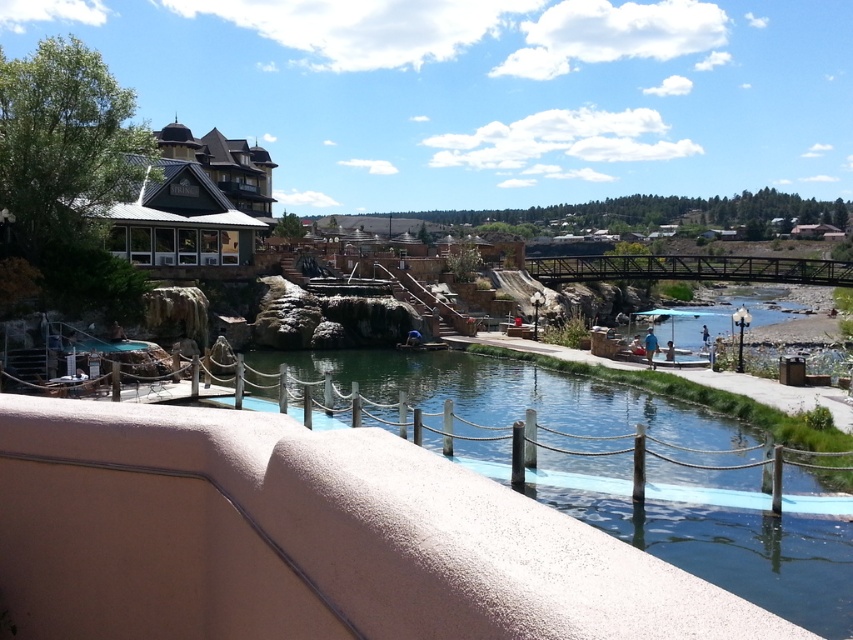
Is point (189, 211) positioned behind point (612, 259)?

That is False.

This screenshot has width=853, height=640. In order to click on green shingles at upper left in this screenshot , I will do `click(194, 202)`.

Looking at this image, is smooth concrete river at center to the left of green shingles at upper left from the viewer's perspective?

In fact, smooth concrete river at center is to the right of green shingles at upper left.

This screenshot has height=640, width=853. Describe the element at coordinates (726, 545) in the screenshot. I see `smooth concrete river at center` at that location.

Locate an element on the screen. The image size is (853, 640). smooth concrete river at center is located at coordinates (726, 545).

Does point (596, 388) come closer to viewer compared to point (610, 260)?

Yes.

What do you see at coordinates (726, 545) in the screenshot?
I see `smooth concrete river at center` at bounding box center [726, 545].

You are a GUI agent. You are given a task and a screenshot of the screen. Output one action in this format:
    pyautogui.click(x=<x>, y=<y>)
    Task: Click on the smooth concrete river at center
    
    Given the screenshot: What is the action you would take?
    pyautogui.click(x=726, y=545)